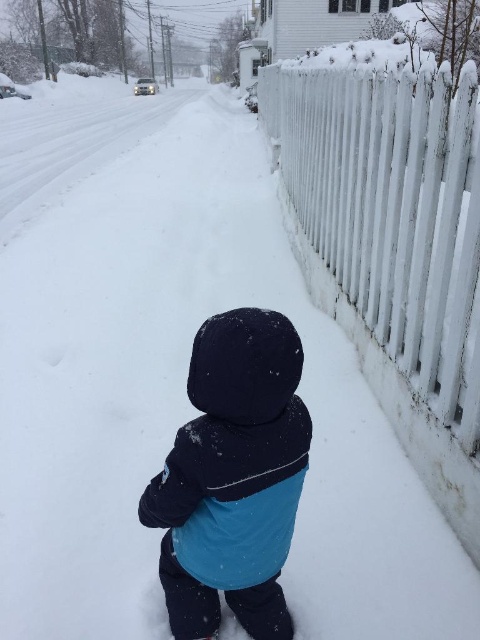
Which is more to the right, white painted wood fence at right or blue fleece jacket at center?

From the viewer's perspective, white painted wood fence at right appears more on the right side.

Is point (364, 218) positioned after point (168, 477)?

Yes, point (364, 218) is behind point (168, 477).

Identify the location of white painted wood fence at right. (393, 212).